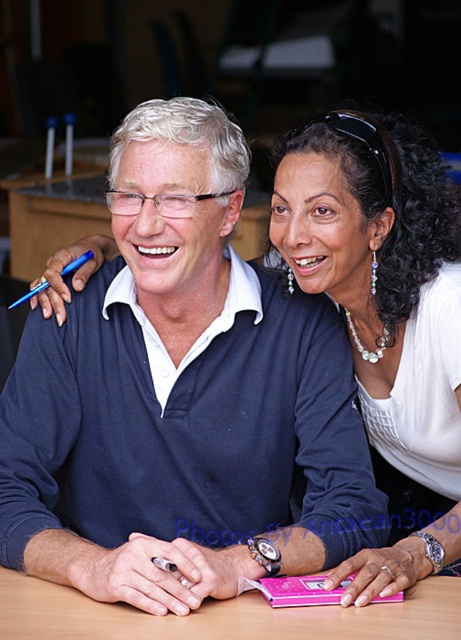
Based on the photo, what object is located at the coordinates point (181, 396)?

The point (181, 396) corresponds to the matte blue sweater at center.

You are organizing a photo shoot and need to ensure that the matte blue sweater at center and the wooden table at center are visible in the frame. Given their sizes, which object would you need to adjust the camera angle to focus on first?

The matte blue sweater at center has a greater height compared to the wooden table at center, so you would need to adjust the camera angle to focus on the matte blue sweater at center first to ensure both are visible.